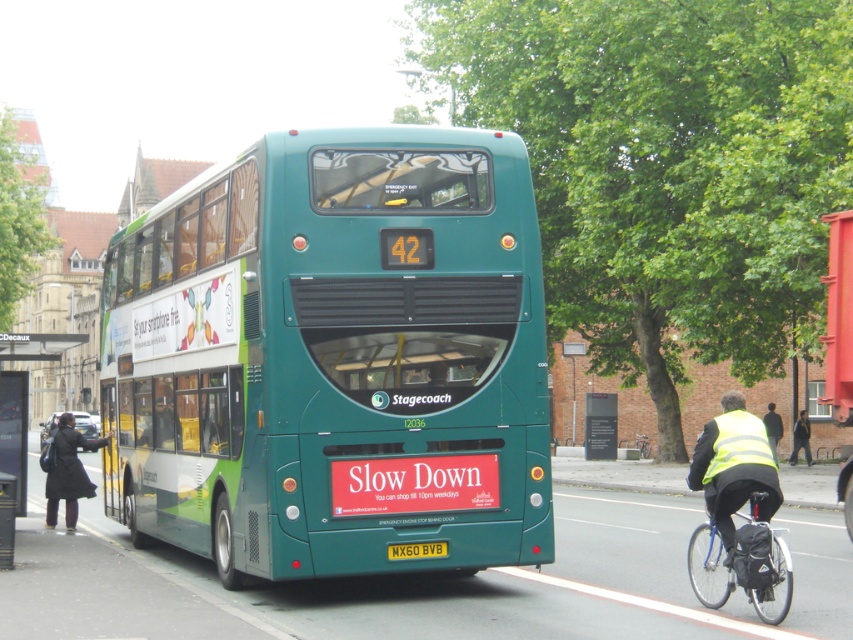
Is blue metallic bicycle at lower right positioned in front of dark blue jeans at lower right?

Yes.

Is blue metallic bicycle at lower right smaller than dark blue jeans at lower right?

Yes.

Which is in front, point (747, 525) or point (798, 449)?

Point (747, 525) is more forward.

Where is `blue metallic bicycle at lower right`? The height and width of the screenshot is (640, 853). blue metallic bicycle at lower right is located at coordinates (743, 564).

Can you confirm if black plastic bus stop at lower left is shorter than dark blue jeans at lower right?

No, black plastic bus stop at lower left is not shorter than dark blue jeans at lower right.

Can you confirm if black plastic bus stop at lower left is wider than dark blue jeans at lower right?

Indeed, black plastic bus stop at lower left has a greater width compared to dark blue jeans at lower right.

Does point (4, 548) lie behind point (804, 444)?

No.

Identify the location of black plastic bus stop at lower left. (10, 458).

Is point (735, 468) more distant than point (49, 472)?

No.

Measure the distance between high visibility yellow vest at lower right and camera.

high visibility yellow vest at lower right and camera are 8.25 meters apart from each other.

Where is `high visibility yellow vest at lower right`? This screenshot has height=640, width=853. high visibility yellow vest at lower right is located at coordinates (733, 467).